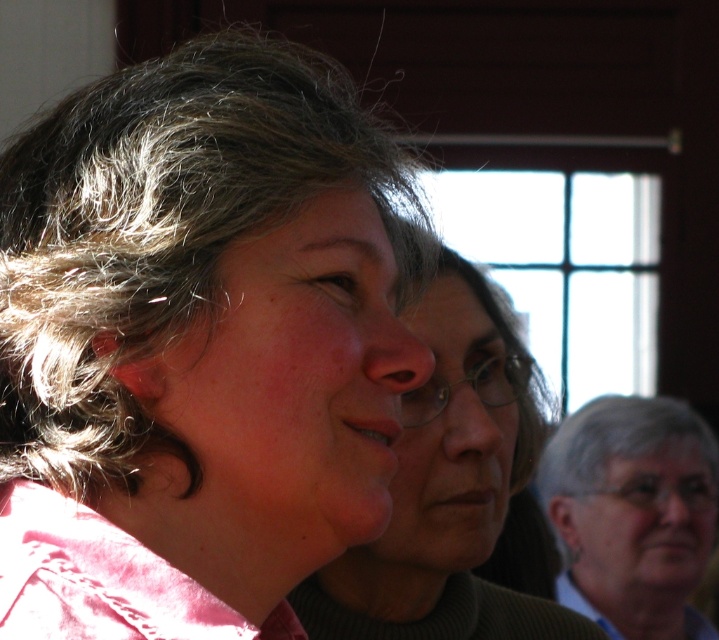
You are a photographer adjusting the camera focus. You need to ensure both the gray curly hair at center and the matte pink shirt at center are in focus. Given their spatial relationship, which object should you prioritize focusing on first to ensure both are sharp?

Since the gray curly hair at center occupies less space than the matte pink shirt at center, you should prioritize focusing on the gray curly hair at center first. This allows the camera to capture its smaller details while still ensuring the larger matte pink shirt at center remains in focus.

You are a photographer adjusting the lighting in a studio. You notice the gray curly hair at center and the matte pink shirt at center. Which object is closer to the camera based on their positions?

The gray curly hair at center is positioned over matte pink shirt at center, so it is closer to the camera.